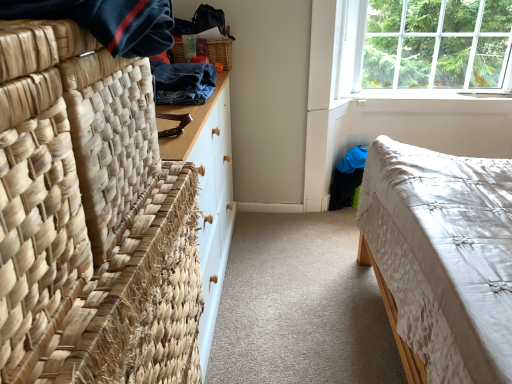
Question: Is denim fabric at upper left, acting as the first clothing starting from the back, to the left of clear glass window at upper right from the viewer's perspective?

Choices:
 (A) yes
 (B) no

Answer: (A)

Question: From the image's perspective, is denim fabric at upper left, the second clothing from the front, located beneath clear glass window at upper right?

Choices:
 (A) no
 (B) yes

Answer: (B)

Question: From the image's perspective, is denim fabric at upper left, acting as the first clothing starting from the back, on clear glass window at upper right?

Choices:
 (A) yes
 (B) no

Answer: (B)

Question: Is clear glass window at upper right at the back of denim fabric at upper left, the second clothing from the front?

Choices:
 (A) no
 (B) yes

Answer: (A)

Question: Could you tell me if denim fabric at upper left, the second clothing from the front, is turned towards clear glass window at upper right?

Choices:
 (A) no
 (B) yes

Answer: (A)

Question: Is denim fabric at upper left, the second clothing from the front, smaller than clear glass window at upper right?

Choices:
 (A) no
 (B) yes

Answer: (B)

Question: From the image's perspective, is dark blue woven fabric at upper left, which is the 1th clothing from front to back, below clear glass window at upper right?

Choices:
 (A) yes
 (B) no

Answer: (A)

Question: From a real-world perspective, does dark blue woven fabric at upper left, the second clothing viewed from the back, sit lower than clear glass window at upper right?

Choices:
 (A) no
 (B) yes

Answer: (A)

Question: Is dark blue woven fabric at upper left, which is the 1th clothing from front to back, smaller than clear glass window at upper right?

Choices:
 (A) no
 (B) yes

Answer: (B)

Question: Is dark blue woven fabric at upper left, which is the 1th clothing from front to back, turned away from clear glass window at upper right?

Choices:
 (A) yes
 (B) no

Answer: (B)

Question: Is dark blue woven fabric at upper left, which is the 1th clothing from front to back, at the right side of clear glass window at upper right?

Choices:
 (A) yes
 (B) no

Answer: (B)

Question: Is dark blue woven fabric at upper left, which is the 1th clothing from front to back, in contact with clear glass window at upper right?

Choices:
 (A) no
 (B) yes

Answer: (A)

Question: Is denim fabric at upper left, acting as the first clothing starting from the back, bigger than woven wood picnic basket at upper center?

Choices:
 (A) no
 (B) yes

Answer: (B)